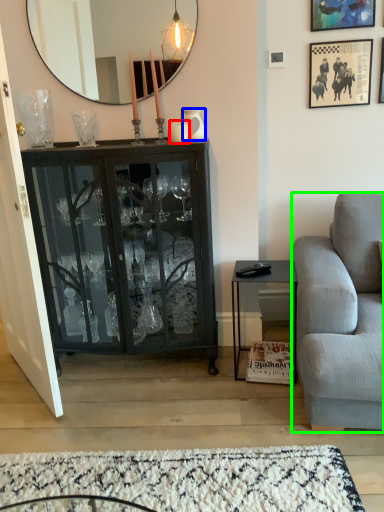
Question: Estimate the real-world distances between objects in this image. Which object is farther from coffee cup (highlighted by a red box), vase (highlighted by a blue box) or studio couch (highlighted by a green box)?

Choices:
 (A) vase
 (B) studio couch

Answer: (B)